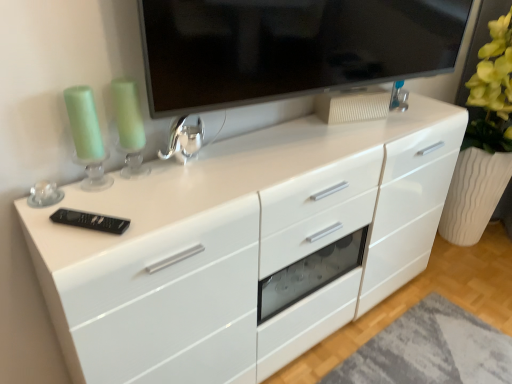
Locate an element on the screen. The image size is (512, 384). free spot in front of black plastic remote at lower left, the 1th appliance in the front-to-back sequence is located at coordinates (76, 249).